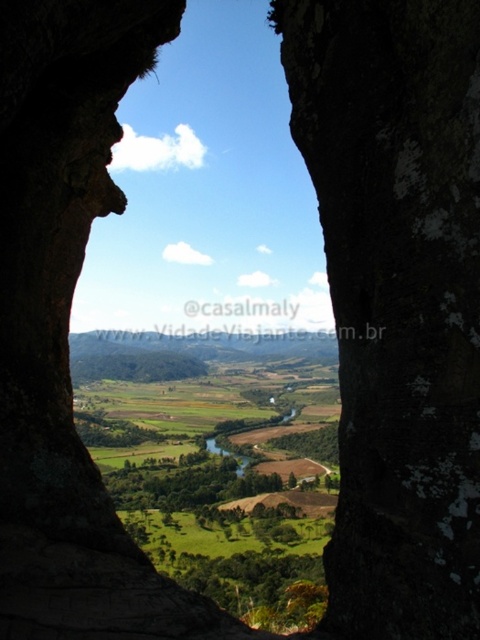
Question: Which of the following is the farthest from the observer?

Choices:
 (A) brown rough rock at center
 (B) green grassy field at center
 (C) green grassy river at center

Answer: (C)

Question: Is dark brown textured rock at center in front of brown rough rock at center?

Choices:
 (A) yes
 (B) no

Answer: (A)

Question: Is green grassy field at center wider than green grassy river at center?

Choices:
 (A) yes
 (B) no

Answer: (A)

Question: Which object appears farthest from the camera in this image?

Choices:
 (A) green grassy river at center
 (B) dark brown textured rock at center

Answer: (A)

Question: Which point is farther to the camera?

Choices:
 (A) green grassy river at center
 (B) green grassy field at center
 (C) dark brown textured rock at center

Answer: (A)

Question: Is dark brown textured rock at center smaller than green grassy river at center?

Choices:
 (A) yes
 (B) no

Answer: (A)